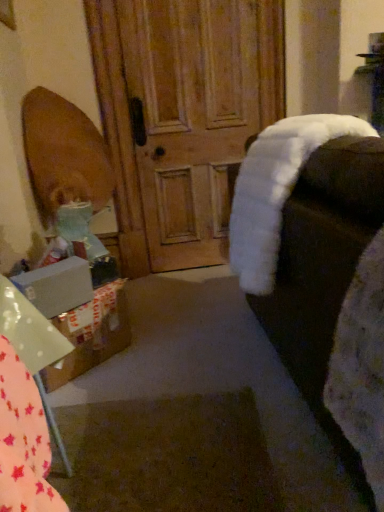
Question: Is white fluffy rocking chair at right wider or thinner than white matte box at lower left?

Choices:
 (A) wide
 (B) thin

Answer: (A)

Question: From the image's perspective, is white fluffy rocking chair at right located above or below white matte box at lower left?

Choices:
 (A) above
 (B) below

Answer: (A)

Question: Which object is positioned farthest from the white fluffy rocking chair at right?

Choices:
 (A) white cardboard box at lower left
 (B) cardboard box at lower left
 (C) wooden door at center
 (D) white matte box at lower left

Answer: (C)

Question: Which is nearer to the white cardboard box at lower left?

Choices:
 (A) wooden door at center
 (B) white fluffy rocking chair at right
 (C) cardboard box at lower left
 (D) white matte box at lower left

Answer: (D)